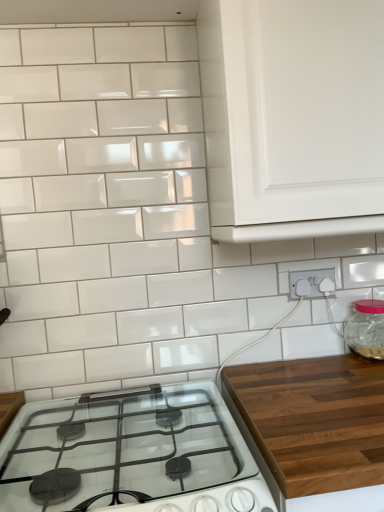
In order to click on white glossy gas stove at lower center in this screenshot , I will do `click(131, 455)`.

Find the location of a particular element. white glossy cabinet at upper right is located at coordinates (293, 117).

The width and height of the screenshot is (384, 512). In order to click on transparent glass jar at right in this screenshot , I will do `click(367, 329)`.

Locate an element on the screen. The image size is (384, 512). white glossy gas stove at lower center is located at coordinates (131, 455).

Is transparent glass jar at right turned away from white glossy gas stove at lower center?

transparent glass jar at right is not turned away from white glossy gas stove at lower center.

From a real-world perspective, relative to white glossy gas stove at lower center, is transparent glass jar at right vertically above or below?

Clearly, from a real-world perspective, transparent glass jar at right is above white glossy gas stove at lower center.

In the scene shown: Relative to white glossy gas stove at lower center, is transparent glass jar at right in front or behind?

In the image, transparent glass jar at right appears behind white glossy gas stove at lower center.

Is transparent glass jar at right bigger or smaller than white glossy gas stove at lower center?

Considering their sizes, transparent glass jar at right takes up less space than white glossy gas stove at lower center.

Is white glossy cabinet at upper right at the back of transparent glass jar at right?

No, white glossy cabinet at upper right is not at the back of transparent glass jar at right.

Does transparent glass jar at right have a larger size compared to white glossy cabinet at upper right?

Actually, transparent glass jar at right might be smaller than white glossy cabinet at upper right.

From the picture: From the image's perspective, is transparent glass jar at right below white glossy cabinet at upper right?

Yes, from the image's perspective, transparent glass jar at right is beneath white glossy cabinet at upper right.

Is transparent glass jar at right to the left or to the right of white glossy cabinet at upper right in the image?

Clearly, transparent glass jar at right is on the right of white glossy cabinet at upper right in the image.

Is white plastic electrical outlet at lower right in front of white glossy cabinet at upper right?

That is False.

Is white plastic electrical outlet at lower right at the right side of white glossy cabinet at upper right?

Yes.

From a real-world perspective, between white plastic electrical outlet at lower right and white glossy cabinet at upper right, who is vertically higher?

white glossy cabinet at upper right, from a real-world perspective.

Between white glossy cabinet at upper right and transparent glass jar at right, which one appears on the left side from the viewer's perspective?

Positioned to the left is white glossy cabinet at upper right.

Is point (380, 99) positioned after point (353, 317)?

No.

Could transparent glass jar at right be considered to be inside white glossy cabinet at upper right?

No, white glossy cabinet at upper right does not contain transparent glass jar at right.

How many degrees apart are the facing directions of white glossy cabinet at upper right and transparent glass jar at right?

They differ by 0.103 degrees in their facing directions.

Consider the image. Between white plastic electrical outlet at lower right and transparent glass jar at right, which one appears on the right side from the viewer's perspective?

transparent glass jar at right.

From the image's perspective, is white plastic electrical outlet at lower right on transparent glass jar at right?

Yes.

Based on the photo, which object is thinner, white plastic electrical outlet at lower right or transparent glass jar at right?

white plastic electrical outlet at lower right.

From a real-world perspective, is white glossy gas stove at lower center located higher than transparent glass jar at right?

Actually, white glossy gas stove at lower center is physically below transparent glass jar at right in the real world.

From the image's perspective, is white glossy gas stove at lower center located above or below transparent glass jar at right?

white glossy gas stove at lower center is below transparent glass jar at right.

Is point (79, 490) positioned in front of point (365, 319)?

Yes, it is in front of point (365, 319).

Considering the relative sizes of white glossy cabinet at upper right and white glossy gas stove at lower center in the image provided, is white glossy cabinet at upper right shorter than white glossy gas stove at lower center?

Incorrect, the height of white glossy cabinet at upper right does not fall short of that of white glossy gas stove at lower center.

Is white glossy cabinet at upper right thinner than white glossy gas stove at lower center?

Indeed, white glossy cabinet at upper right has a lesser width compared to white glossy gas stove at lower center.

Consider the image. Who is more distant, white glossy cabinet at upper right or white glossy gas stove at lower center?

white glossy cabinet at upper right.

Looking at this image, is white glossy cabinet at upper right outside of white glossy gas stove at lower center?

white glossy cabinet at upper right lies outside white glossy gas stove at lower center's area.

In the image, there is a transparent glass jar at right. In order to click on gas stove below it (from a real-world perspective) in this screenshot , I will do `click(131, 455)`.

You are a GUI agent. You are given a task and a screenshot of the screen. Output one action in this format:
    pyautogui.click(x=<x>, y=<y>)
    Task: Click on the cabinetry on the left of transparent glass jar at right
    The height and width of the screenshot is (512, 384).
    Given the screenshot: What is the action you would take?
    (x=293, y=117)

When comparing their distances from white glossy gas stove at lower center, does white plastic electrical outlet at lower right or white glossy cabinet at upper right seem further?

white glossy cabinet at upper right is further to white glossy gas stove at lower center.

Looking at the image, which one is located closer to white plastic electrical outlet at lower right, white glossy gas stove at lower center or transparent glass jar at right?

transparent glass jar at right is positioned closer to the anchor white plastic electrical outlet at lower right.

Estimate the real-world distances between objects in this image. Which object is further from white plastic electrical outlet at lower right, transparent glass jar at right or white glossy cabinet at upper right?

white glossy cabinet at upper right is further to white plastic electrical outlet at lower right.

Which object lies nearer to the anchor point white glossy cabinet at upper right, transparent glass jar at right or white glossy gas stove at lower center?

transparent glass jar at right is positioned closer to the anchor white glossy cabinet at upper right.

Considering their positions, is transparent glass jar at right positioned closer to white glossy gas stove at lower center than white plastic electrical outlet at lower right?

white plastic electrical outlet at lower right.

Estimate the real-world distances between objects in this image. Which object is closer to transparent glass jar at right, white glossy cabinet at upper right or white plastic electrical outlet at lower right?

The object closer to transparent glass jar at right is white plastic electrical outlet at lower right.

Based on their spatial positions, is white glossy cabinet at upper right or white glossy gas stove at lower center closer to transparent glass jar at right?

white glossy cabinet at upper right lies closer to transparent glass jar at right than the other object.

From the image, which object appears to be nearer to white glossy cabinet at upper right, white glossy gas stove at lower center or white plastic electrical outlet at lower right?

white plastic electrical outlet at lower right is closer to white glossy cabinet at upper right.

Identify the location of electric outlet between white glossy cabinet at upper right and white glossy gas stove at lower center vertically. (312, 283).

The image size is (384, 512). I want to click on glass jar positioned between white glossy gas stove at lower center and white plastic electrical outlet at lower right from near to far, so click(x=367, y=329).

Where is `glass jar between white glossy cabinet at upper right and white glossy gas stove at lower center vertically`? glass jar between white glossy cabinet at upper right and white glossy gas stove at lower center vertically is located at coordinates (367, 329).

Locate an element on the screen. electric outlet between white glossy cabinet at upper right and transparent glass jar at right vertically is located at coordinates (312, 283).